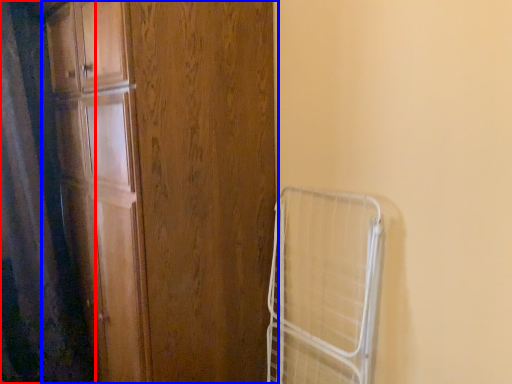
Question: Which of the following is the farthest to the observer, shower curtain (highlighted by a red box) or door (highlighted by a blue box)?

Choices:
 (A) shower curtain
 (B) door

Answer: (A)